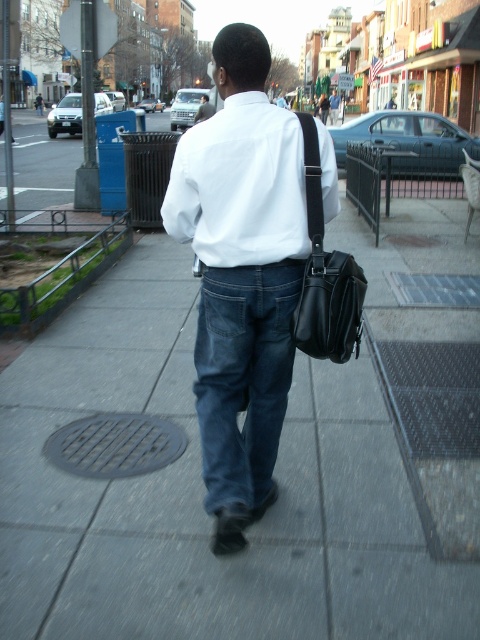
Does white matte shirt at center appear on the left side of matte white shirt at center?

Yes, white matte shirt at center is to the left of matte white shirt at center.

Looking at this image, does white matte shirt at center have a greater width compared to matte white shirt at center?

No.

Describe the element at coordinates (242, 275) in the screenshot. I see `white matte shirt at center` at that location.

Identify the location of white matte shirt at center. This screenshot has height=640, width=480. (242, 275).

Who is more forward, [195,241] or [229,320]?

Point [229,320] is more forward.

This screenshot has width=480, height=640. In order to click on white smooth dress shirt at center in this screenshot , I will do `click(240, 186)`.

You are a GUI agent. You are given a task and a screenshot of the screen. Output one action in this format:
    pyautogui.click(x=<x>, y=<y>)
    Task: Click on the white smooth dress shirt at center
    This screenshot has width=480, height=640.
    Given the screenshot: What is the action you would take?
    pyautogui.click(x=240, y=186)

Does point (223, 397) come behind point (216, 284)?

Yes, it is behind point (216, 284).

Is white matte shirt at center thinner than dark blue denim jeans at center?

No, white matte shirt at center is not thinner than dark blue denim jeans at center.

Find the location of a particular element. The image size is (480, 640). white matte shirt at center is located at coordinates (242, 275).